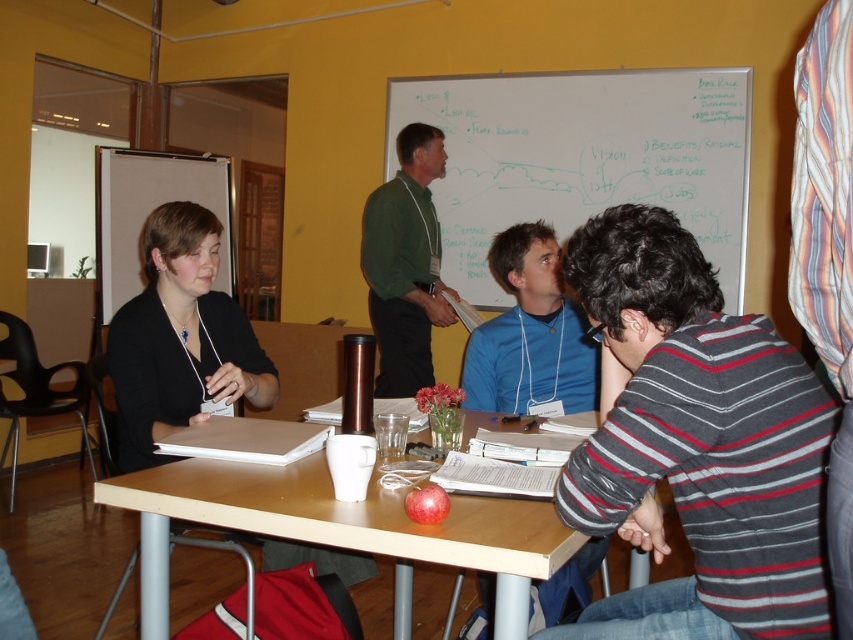
Is point (230, 499) farther from viewer compared to point (432, 509)?

Yes, point (230, 499) is farther from viewer.

Which is in front, point (548, 568) or point (426, 522)?

Point (548, 568) is more forward.

Which is in front, point (109, 486) or point (431, 524)?

Positioned in front is point (431, 524).

Where is `wooden table at center`? Image resolution: width=853 pixels, height=640 pixels. wooden table at center is located at coordinates (340, 529).

Does blue cotton shirt at center appear over red matte apple at center?

Indeed, blue cotton shirt at center is positioned over red matte apple at center.

At what (x,y) coordinates should I click in order to perform the action: click on blue cotton shirt at center. Please return your answer as a coordinate pair (x, y). This screenshot has height=640, width=853. Looking at the image, I should click on (531, 333).

Which is behind, point (729, 141) or point (375, 257)?

Positioned behind is point (375, 257).

Does whiteboard at upper center have a smaller size compared to green matte shirt at center?

No, whiteboard at upper center is not smaller than green matte shirt at center.

Is point (584, 196) positioned behind point (409, 310)?

Yes, point (584, 196) is farther from viewer.

What are the coordinates of `whiteboard at upper center` in the screenshot? It's located at (582, 157).